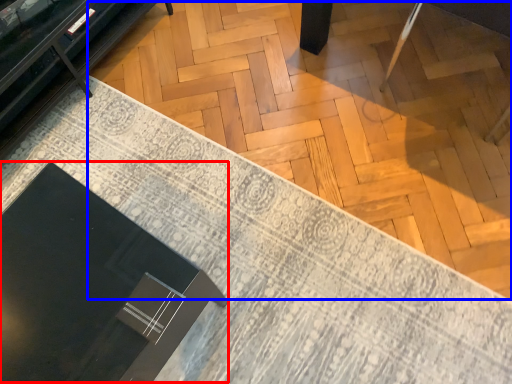
Question: Among these objects, which one is farthest to the camera, round table (highlighted by a red box) or plywood (highlighted by a blue box)?

Choices:
 (A) round table
 (B) plywood

Answer: (B)